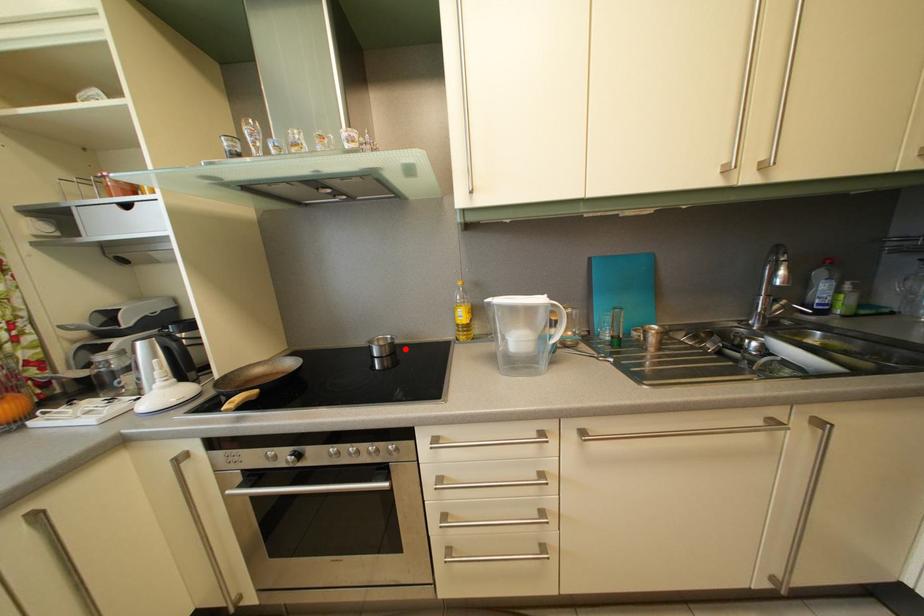
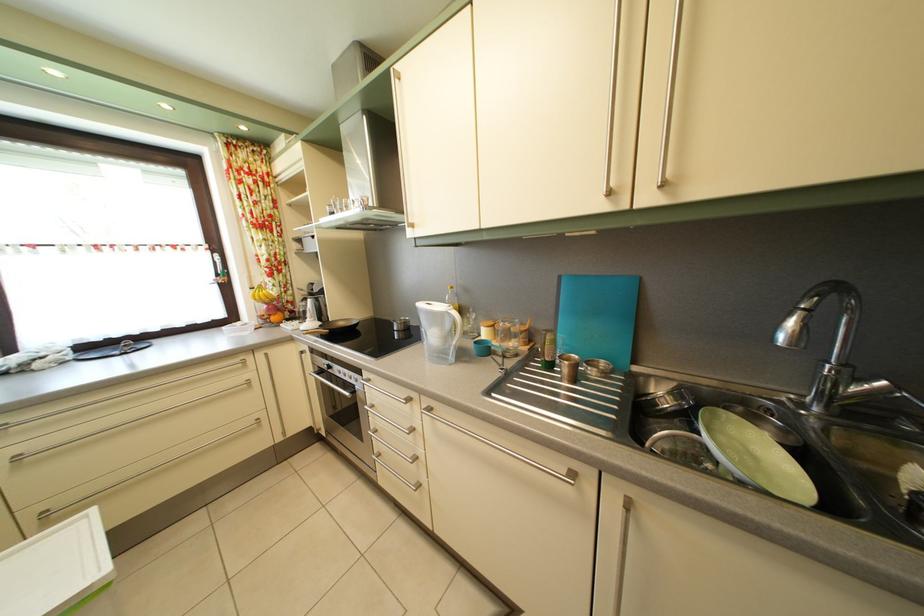
Question: A red point is marked in image1. In image2, is the corresponding 3D point closer to the camera or farther? Reply with the corresponding letter.

Choices:
 (A) The corresponding 3D point is closer.
 (B) The corresponding 3D point is farther.

Answer: (B)